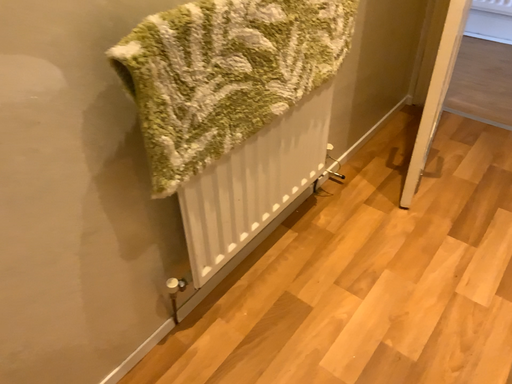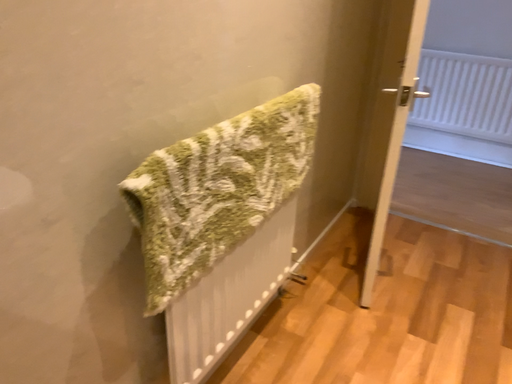
Question: Which way did the camera rotate in the video?

Choices:
 (A) rotated upward
 (B) rotated downward

Answer: (A)